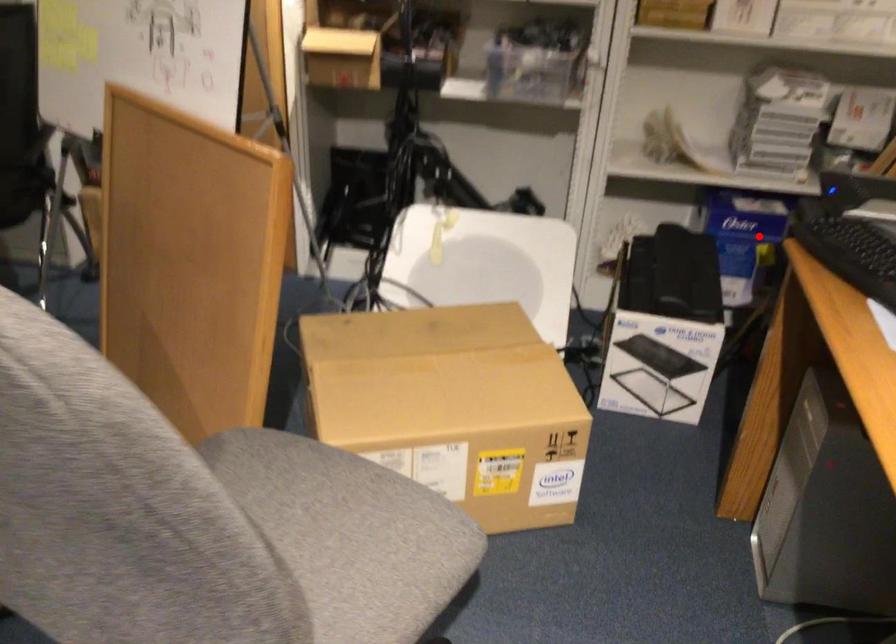
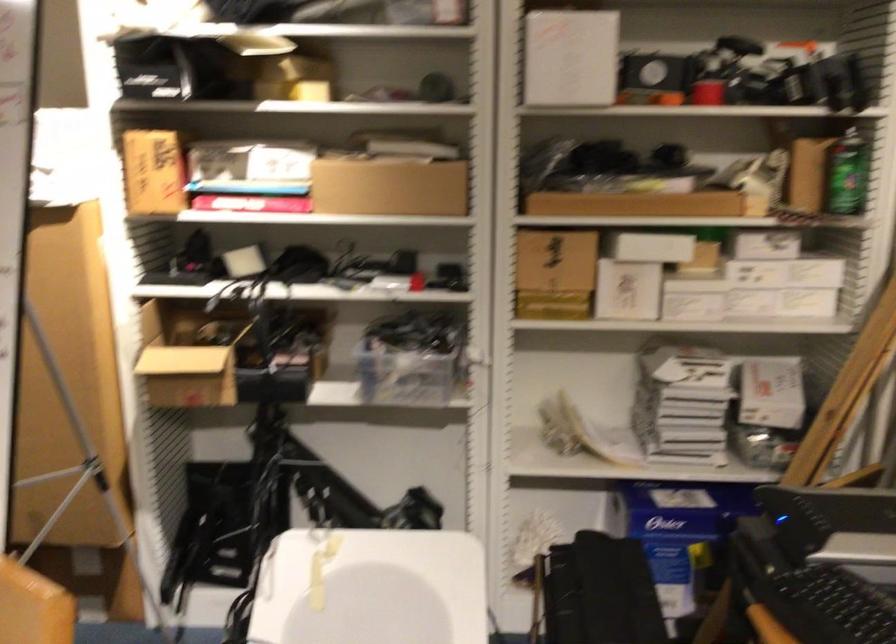
Find the pixel in the second image that matches the highlighted location in the first image.

(683, 534)